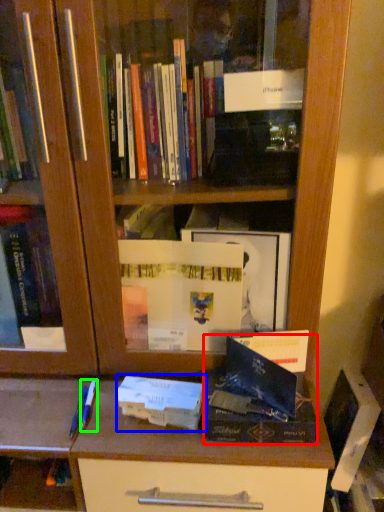
Question: Which is nearer to the paperback book (highlighted by a red box)? paperback book (highlighted by a blue box) or pen (highlighted by a green box).

Choices:
 (A) paperback book
 (B) pen

Answer: (A)